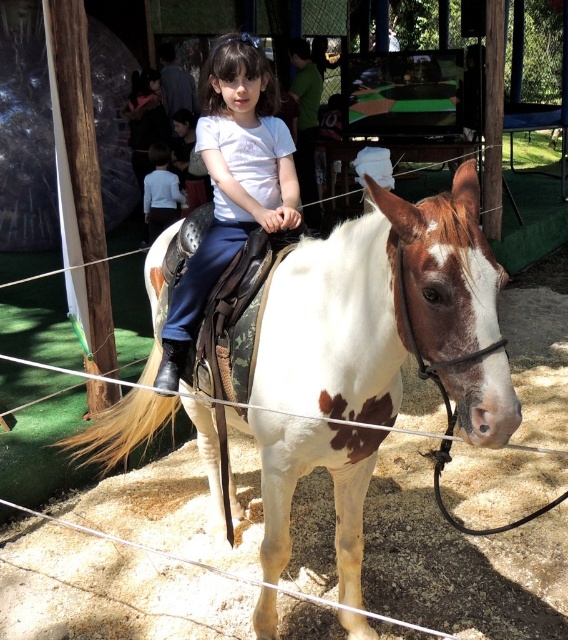
You are a photographer standing in front of the fenced area. You want to take a photo of the white speckled horse at center and the white matte shirt at center. Which object should you focus on first if you want to capture both in sharp focus?

The white speckled horse at center is closer to the viewer than the white matte shirt at center, so you should focus on the horse first to ensure both are in sharp focus.

You are a photographer trying to capture a photo of the white speckled horse at center and the light blue shirt at center. Since you want to ensure the horse is the main focus, which object should you position closer to the camera to emphasize its size?

The white speckled horse at center is taller than the light blue shirt at center, so positioning the white speckled horse at center closer to the camera will make it appear larger and more prominent in the photo.

You are a photographer taking a picture of the girl riding the horse. You notice the white matte shirt at center and the light blue shirt at center. Which shirt should you focus on if you want to capture the one that is lower in the frame?

The white matte shirt at center is located below the light blue shirt at center, so you should focus on the white matte shirt at center to capture the lower one.